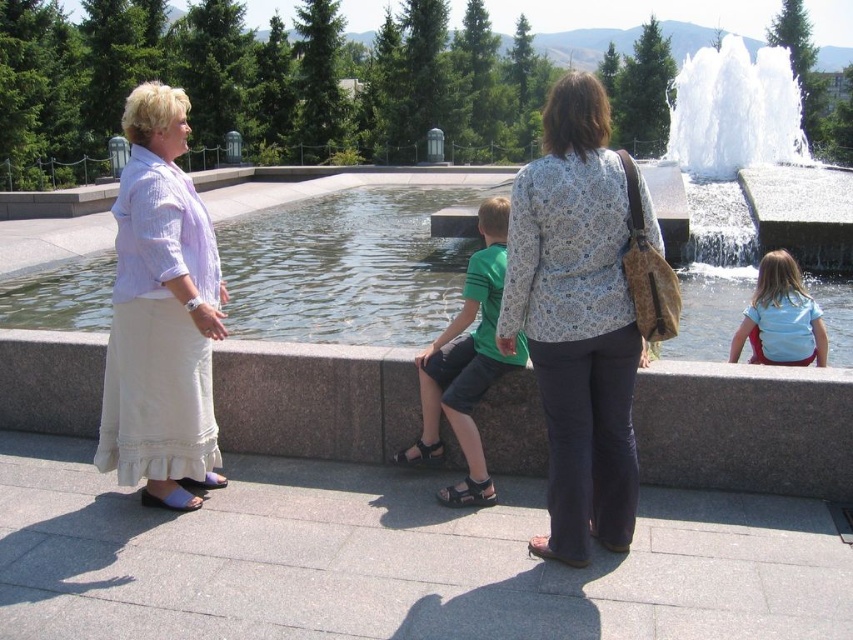
Between gray concrete ledge at center and patterned fabric blouse at center, which one has less height?

gray concrete ledge at center

What do you see at coordinates (746, 428) in the screenshot? I see `gray concrete ledge at center` at bounding box center [746, 428].

What do you see at coordinates (746, 428) in the screenshot?
I see `gray concrete ledge at center` at bounding box center [746, 428].

This screenshot has width=853, height=640. Identify the location of gray concrete ledge at center. (746, 428).

Is patterned fabric blouse at center smaller than linen skirt at left?

Yes, patterned fabric blouse at center is smaller than linen skirt at left.

Who is positioned more to the left, patterned fabric blouse at center or linen skirt at left?

From the viewer's perspective, linen skirt at left appears more on the left side.

Between point (628, 353) and point (149, 138), which one is positioned behind?

The point (149, 138) is behind.

Identify the location of patterned fabric blouse at center. This screenshot has width=853, height=640. (576, 321).

Between gray concrete ledge at center and linen skirt at left, which one is positioned lower?

gray concrete ledge at center is lower down.

Is gray concrete ledge at center thinner than linen skirt at left?

Yes, gray concrete ledge at center is thinner than linen skirt at left.

Which is in front, point (675, 364) or point (131, 266)?

Point (131, 266) is more forward.

You are a GUI agent. You are given a task and a screenshot of the screen. Output one action in this format:
    pyautogui.click(x=<x>, y=<y>)
    Task: Click on the gray concrete ledge at center
    
    Given the screenshot: What is the action you would take?
    pyautogui.click(x=746, y=428)